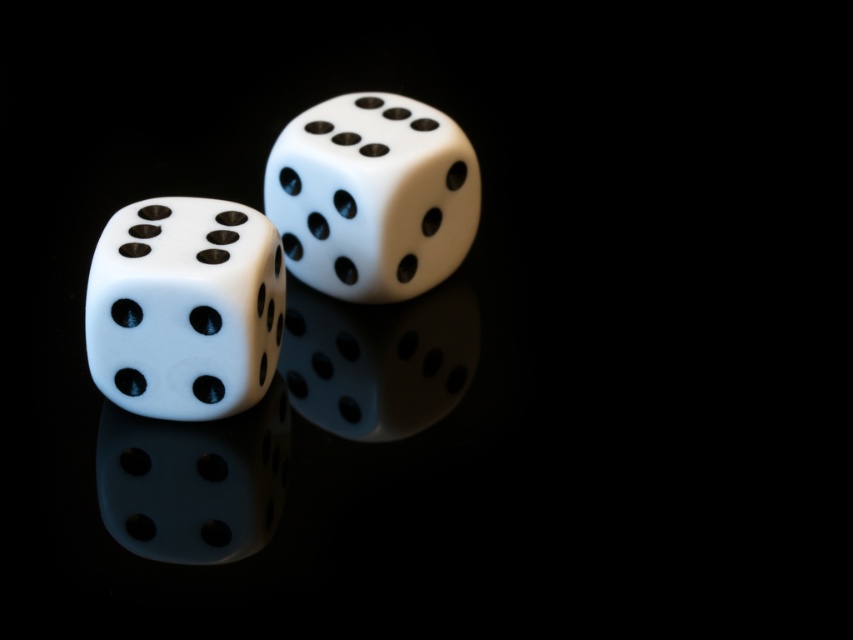
You are a photographer trying to capture a closeup of the matte white dice at left and the matte white dice at center. Which one should you focus on first to ensure the closest one is sharp?

The matte white dice at left is closer to the viewer than the matte white dice at center, so you should focus on the matte white dice at left first to ensure it is sharp.

You are a game designer creating a digital version of this scene. You need to place a virtual marker at the exact 2D coordinates where the matte white dice at left is located. What are the coordinates you should use?

The coordinates for the matte white dice at left are at point (184, 307).